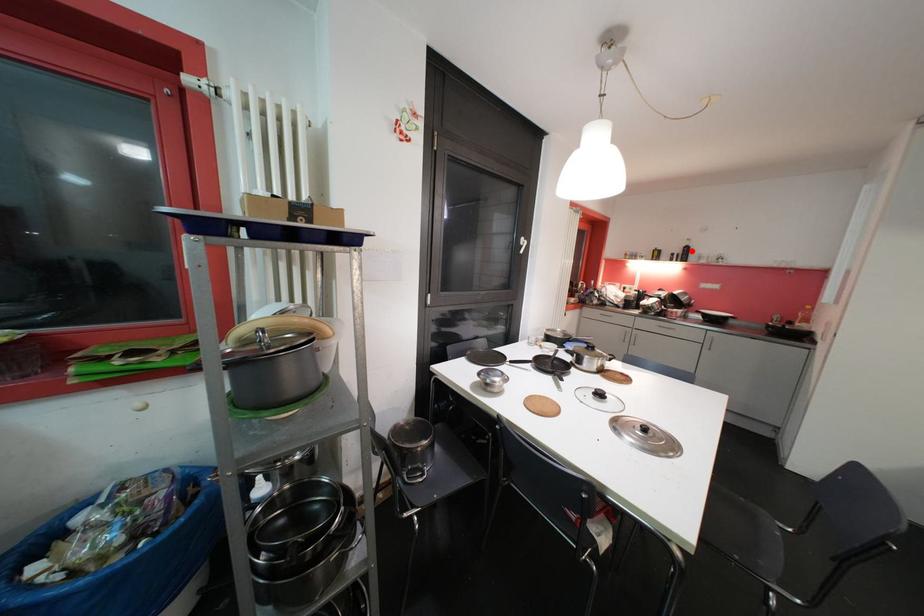
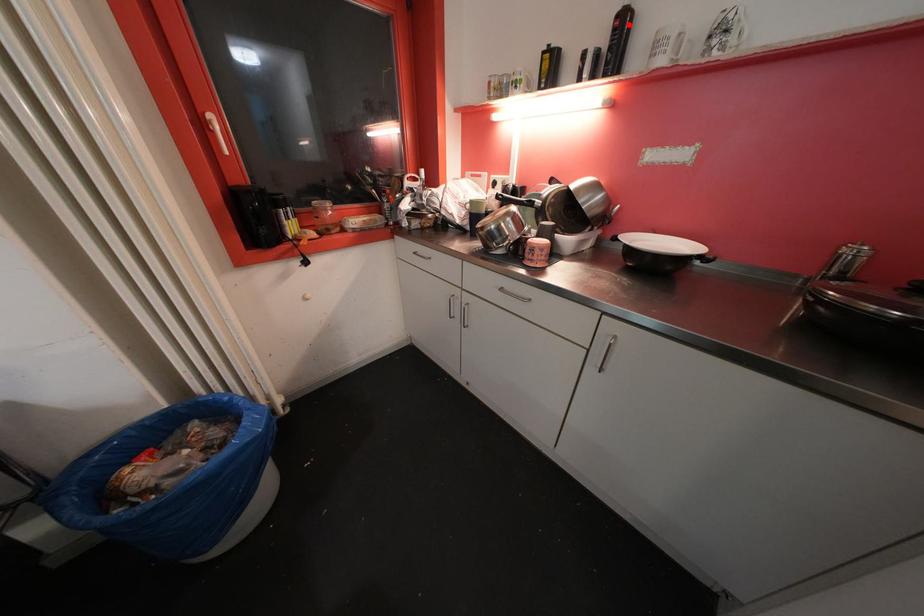
I am providing you with two images of the same scene from different viewpoints. A red point is marked on the first image and another point is marked on the second image. Are the points marked in image1 and image2 representing the same 3D position?

Yes